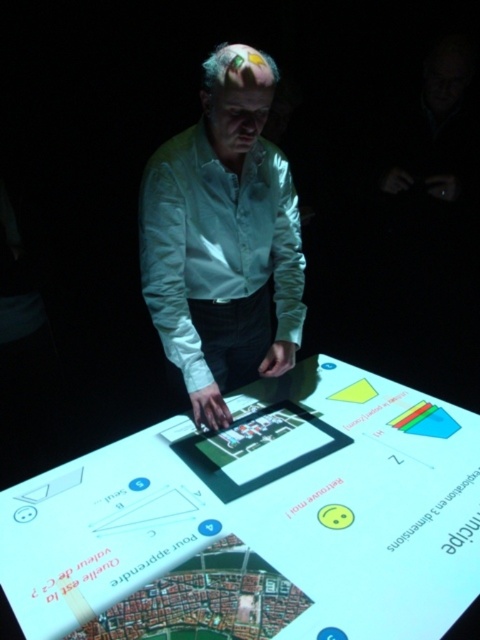
Question: Is translucent glass table at center to the left of white silk shirt at center from the viewer's perspective?

Choices:
 (A) no
 (B) yes

Answer: (A)

Question: Is translucent glass table at center bigger than white silk shirt at center?

Choices:
 (A) no
 (B) yes

Answer: (B)

Question: Can you confirm if translucent glass table at center is positioned below white silk shirt at center?

Choices:
 (A) no
 (B) yes

Answer: (B)

Question: Which object is farther from the camera taking this photo?

Choices:
 (A) translucent glass table at center
 (B) white silk shirt at center

Answer: (B)

Question: Which point appears closest to the camera in this image?

Choices:
 (A) (222, 410)
 (B) (384, 492)

Answer: (B)